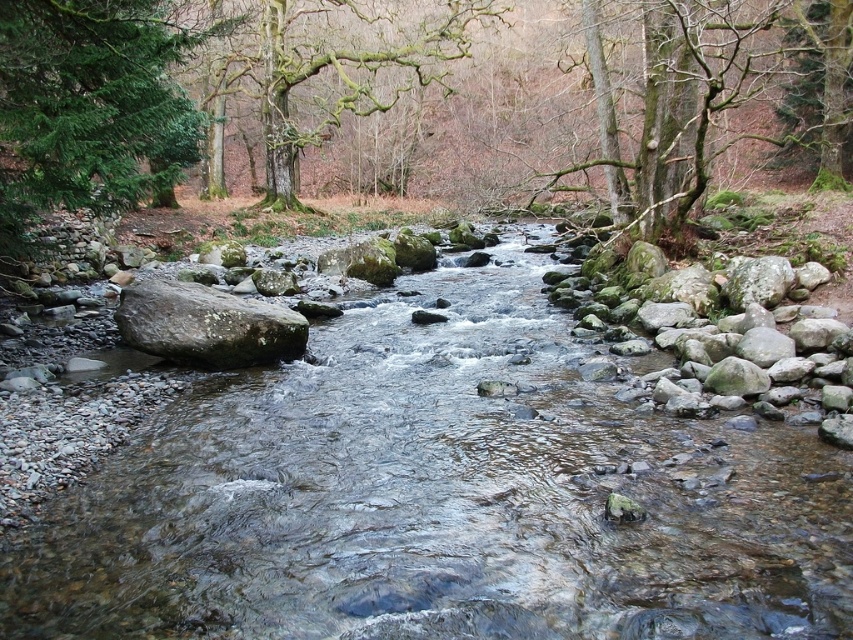
Question: Which point is closer to the camera?

Choices:
 (A) (671, 545)
 (B) (583, 26)
 (C) (814, 51)

Answer: (A)

Question: Based on their relative distances, which object is nearer to the brown rough rock at left?

Choices:
 (A) green mossy tree at upper right
 (B) green mossy bark tree at upper right
 (C) clear water at center

Answer: (C)

Question: Is the position of green mossy bark tree at upper right less distant than that of brown rough rock at left?

Choices:
 (A) yes
 (B) no

Answer: (B)

Question: Which point appears closest to the camera in this image?

Choices:
 (A) tap(277, 563)
 (B) tap(606, 108)

Answer: (A)

Question: Can you confirm if clear water at center is wider than mossy bark tree at upper center?

Choices:
 (A) yes
 (B) no

Answer: (B)

Question: Does clear water at center have a larger size compared to green mossy bark tree at upper right?

Choices:
 (A) yes
 (B) no

Answer: (B)